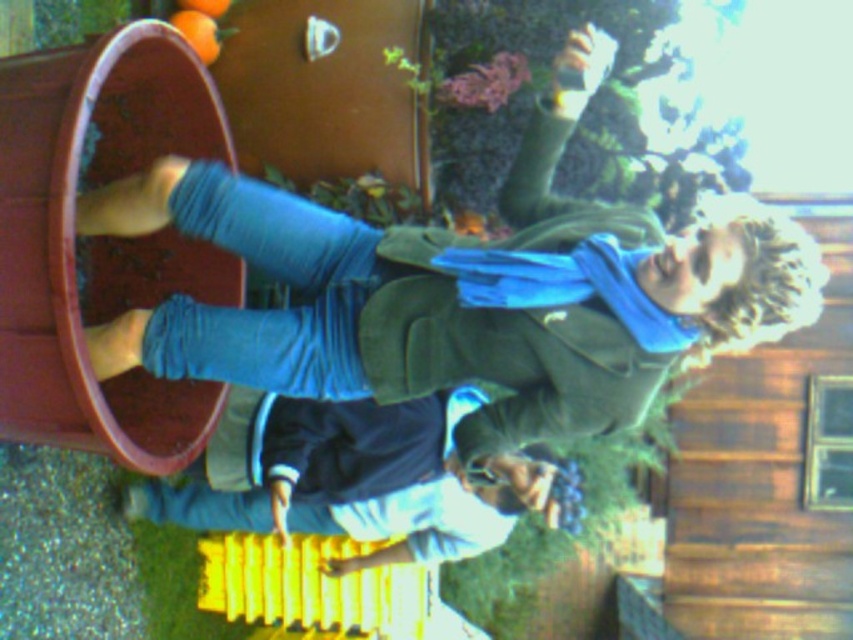
Question: Based on their relative distances, which object is nearer to the dark blue jeans at lower center?

Choices:
 (A) blue cotton scarf at upper right
 (B) orange matte at upper center

Answer: (A)

Question: Is dark blue jeans at lower center to the right of smooth orange at upper center from the viewer's perspective?

Choices:
 (A) yes
 (B) no

Answer: (A)

Question: Which object is the farthest from the orange matte at upper center?

Choices:
 (A) blue cotton scarf at upper right
 (B) smooth orange at upper center
 (C) dark blue jeans at lower center

Answer: (C)

Question: Does orange matte at upper center appear under smooth orange at upper center?

Choices:
 (A) yes
 (B) no

Answer: (A)

Question: In this image, where is orange matte at upper center located relative to smooth orange at upper center?

Choices:
 (A) right
 (B) left

Answer: (A)

Question: Which is farther from the dark blue jeans at lower center?

Choices:
 (A) blue cotton scarf at upper right
 (B) smooth orange at upper center
 (C) orange matte at upper center

Answer: (B)